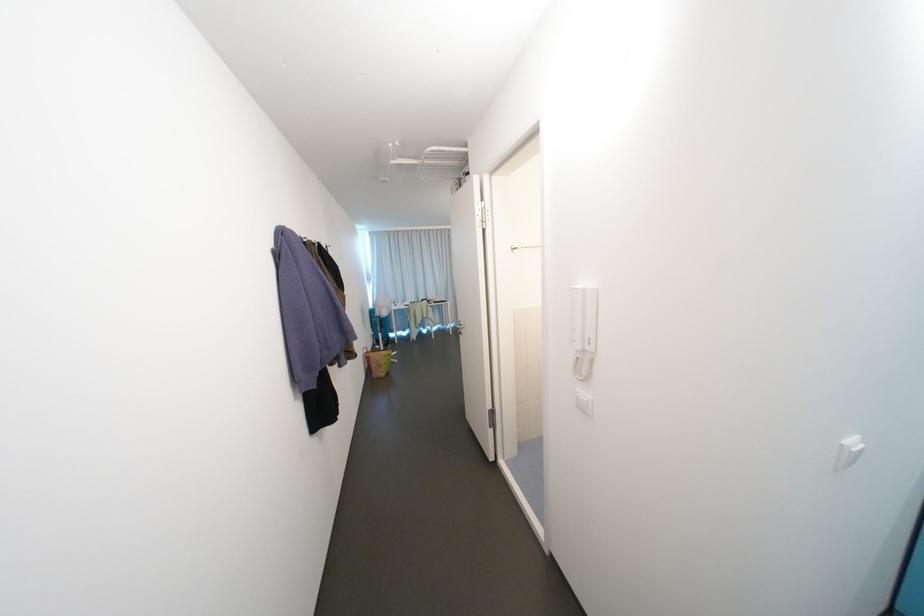
Where is `intercom handset`? Image resolution: width=924 pixels, height=616 pixels. intercom handset is located at coordinates (577, 317).